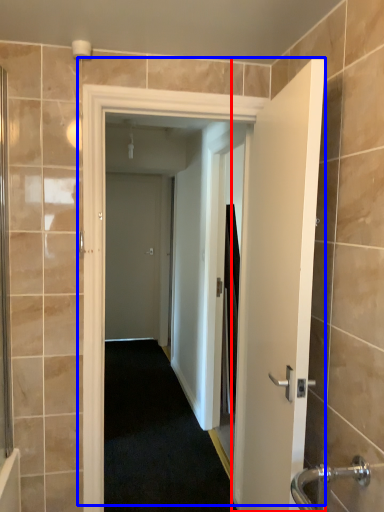
Question: Among these objects, which one is farthest to the camera, door (highlighted by a red box) or door (highlighted by a blue box)?

Choices:
 (A) door
 (B) door

Answer: (B)